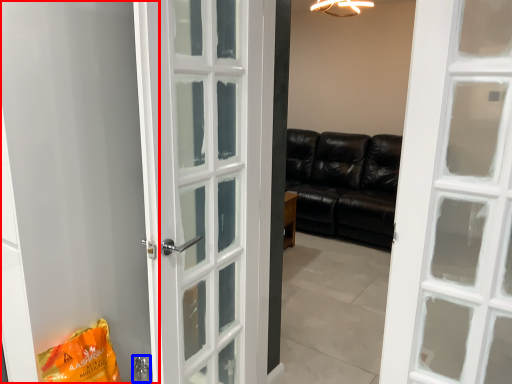
Question: Which of the following is the closest to the observer, screen door (highlighted by a red box) or door handle (highlighted by a blue box)?

Choices:
 (A) screen door
 (B) door handle

Answer: (A)